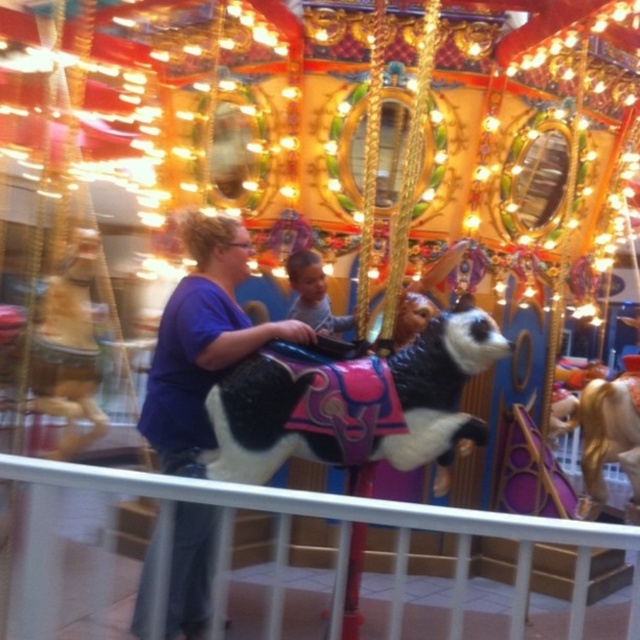
This screenshot has height=640, width=640. Describe the element at coordinates (202, 342) in the screenshot. I see `purple cotton shirt at center` at that location.

Does purple cotton shirt at center have a greater height compared to golden polished horse at right?

Yes, purple cotton shirt at center is taller than golden polished horse at right.

Is point (298, 323) farther from camera compared to point (632, 476)?

No, it is in front of (632, 476).

Locate an element on the screen. Image resolution: width=640 pixels, height=640 pixels. purple cotton shirt at center is located at coordinates (202, 342).

Can you confirm if purple cotton shirt at center is positioned above smooth skin child at center?

Incorrect, purple cotton shirt at center is not positioned above smooth skin child at center.

Which is in front, point (195, 392) or point (316, 280)?

Point (195, 392)

Which is behind, point (301, 340) or point (333, 320)?

The point (333, 320) is more distant.

Image resolution: width=640 pixels, height=640 pixels. What are the coordinates of `purple cotton shirt at center` in the screenshot? It's located at (202, 342).

Does black and white plush horse at center have a greater height compared to smooth skin child at center?

In fact, black and white plush horse at center may be shorter than smooth skin child at center.

The width and height of the screenshot is (640, 640). Describe the element at coordinates (353, 403) in the screenshot. I see `black and white plush horse at center` at that location.

Is point (416, 368) positioned after point (304, 257)?

No, it is not.

Where is `black and white plush horse at center`? This screenshot has width=640, height=640. black and white plush horse at center is located at coordinates (353, 403).